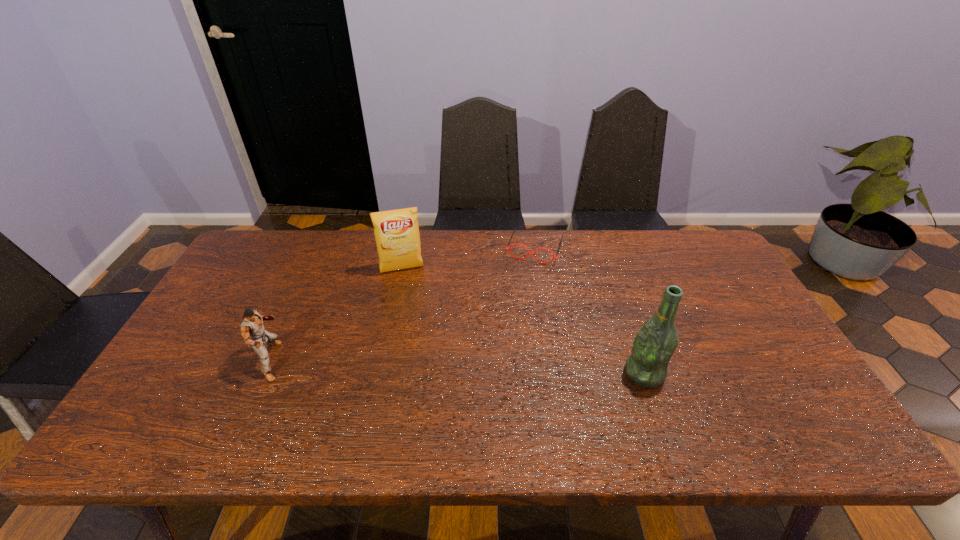
Locate an element on the screen. This screenshot has width=960, height=540. the leftmost object is located at coordinates (252, 330).

The image size is (960, 540). What are the coordinates of `the third tallest object` in the screenshot? It's located at (252, 330).

This screenshot has height=540, width=960. Find the location of `beer bottle`. beer bottle is located at coordinates (654, 345).

Find the location of `the rightmost object`. the rightmost object is located at coordinates (654, 345).

The height and width of the screenshot is (540, 960). In order to click on spectacles in this screenshot , I will do `click(515, 228)`.

At what (x,y) coordinates should I click in order to perform the action: click on the second object from right to left. Please return your answer as a coordinate pair (x, y). The image size is (960, 540). Looking at the image, I should click on (515, 228).

The width and height of the screenshot is (960, 540). Identify the location of crisp (potato chip). (396, 232).

Locate an element on the screen. This screenshot has width=960, height=540. the third object from right to left is located at coordinates (396, 232).

Identify the location of vacant space situated 0.120m on the front-facing side of the third tallest object. The width and height of the screenshot is (960, 540). (333, 361).

The width and height of the screenshot is (960, 540). What are the coordinates of `vacant region located on the surface of the beer bottle` in the screenshot? It's located at (569, 373).